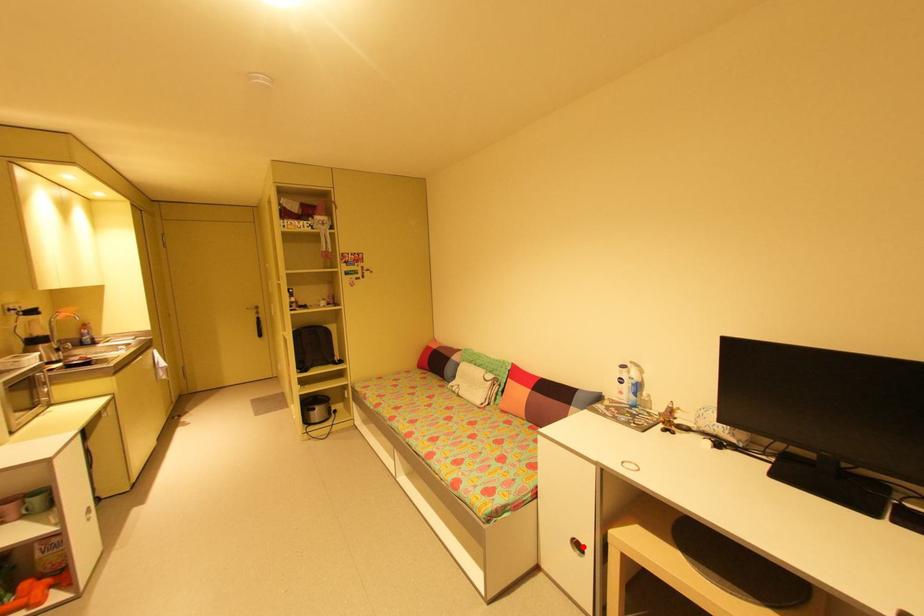
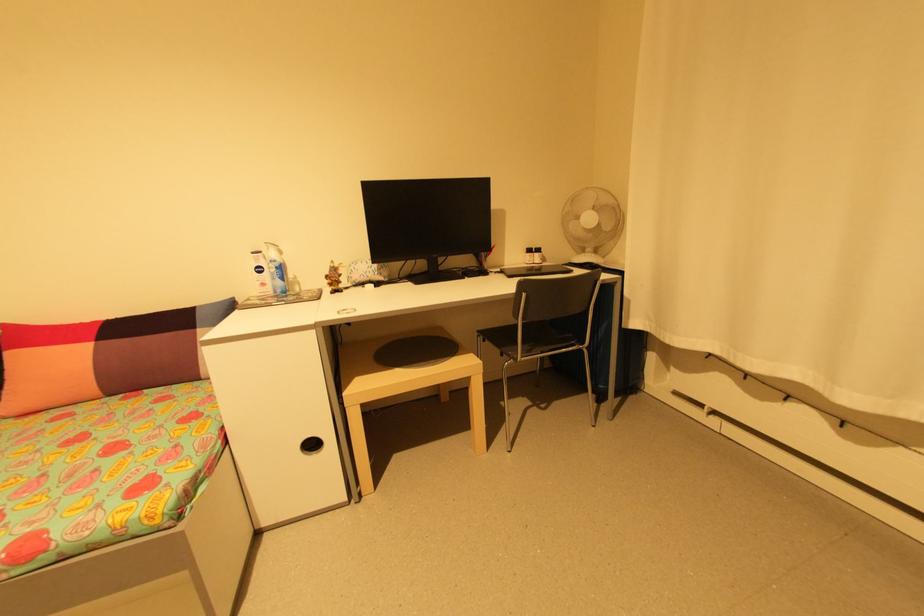
The point at the highlighted location is marked in the first image. Where is the corresponding point in the second image?

(317, 446)